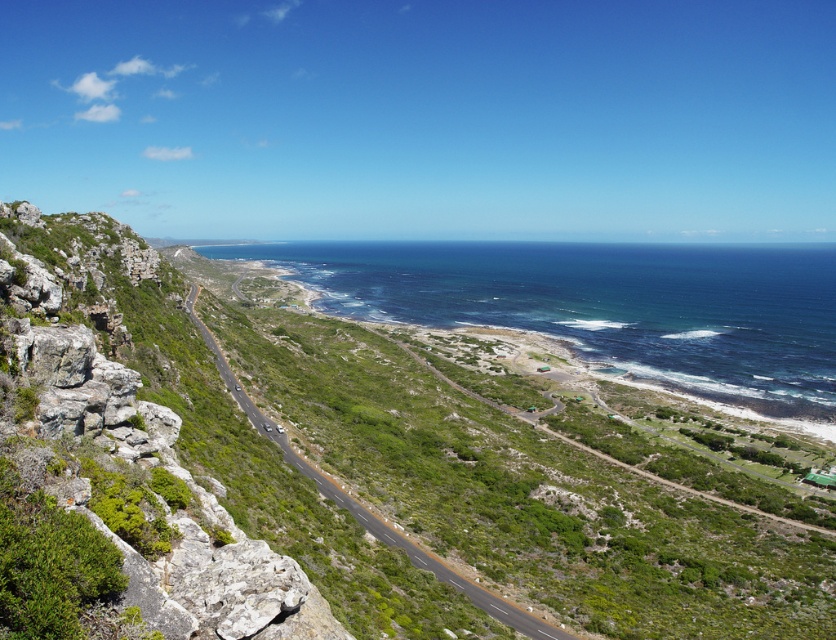
You are a hiker planning to cross from the green grassy hillside at lower left to the green grassy road at center. Which path would you take if you prefer a wider route?

The green grassy hillside at lower left has a larger width than the green grassy road at center, so you should take the green grassy hillside at lower left for a wider path.

You are a hiker planning to climb the green grassy hillside at lower left and the green mossy rock at left. Which one do you think will require more effort due to its height?

The green grassy hillside at lower left is much taller than the green mossy rock at left, so climbing it will require more effort due to its greater height.